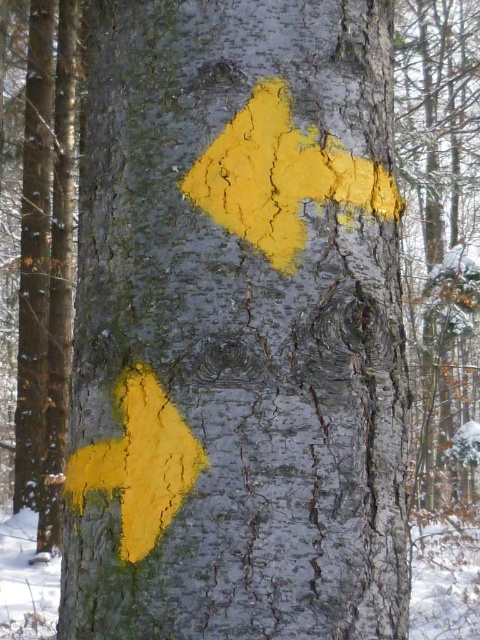
You are standing in a snowy forest and see two points marked on a tree trunk. The first point is at coordinates point (247,200) and the second is at point (165,435). Which point is closer to you?

Point (247,200) is further to the viewer than point (165,435), so the point closer to you is point (165,435).